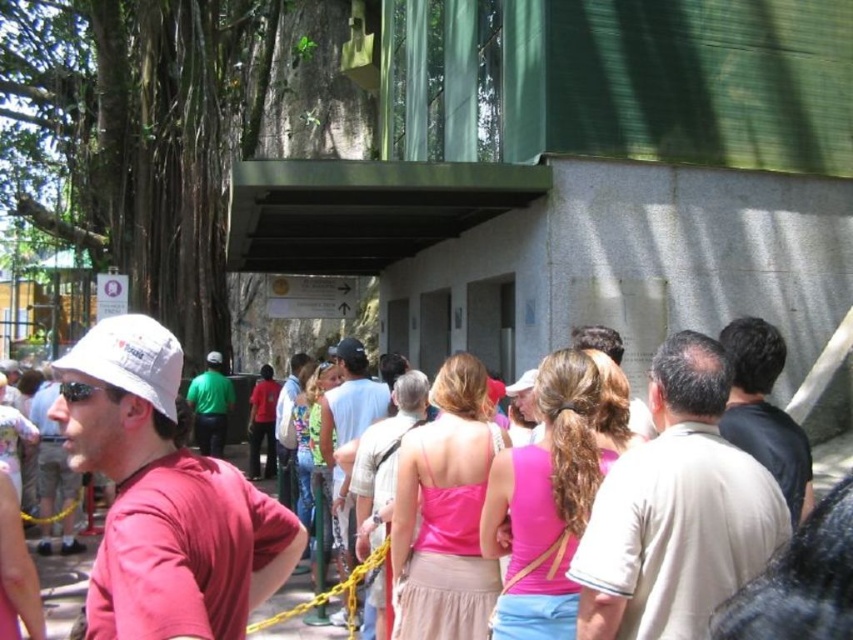
You are standing at the entrance of the zoo and see both the light brown leather jacket at center and the green fabric shirt at center. Which one is nearer to you?

The light brown leather jacket at center is closer to the viewer than the green fabric shirt at center, so the light brown leather jacket at center is nearer to you.

You are standing at the entrance of the zoo and notice two people wearing jackets and shirts. The light brown leather jacket at center and the green fabric shirt at center. Which one is positioned to the right of the other?

The light brown leather jacket at center is to the right of the green fabric shirt at center.